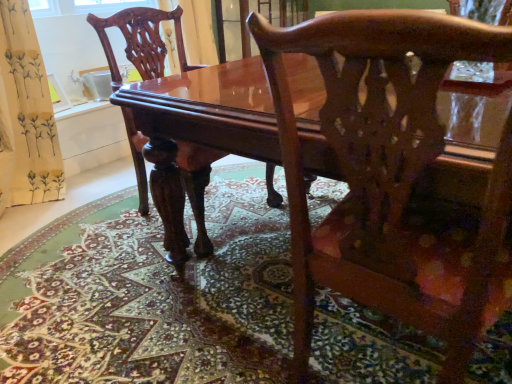
Question: Could you tell me if carpeted floor at center is facing glossy wood chair at center, placed as the 2th chair when sorted from front to back?

Choices:
 (A) no
 (B) yes

Answer: (A)

Question: Is carpeted floor at center to the right of glossy wood chair at center, which is the first chair in left-to-right order, from the viewer's perspective?

Choices:
 (A) yes
 (B) no

Answer: (B)

Question: Does carpeted floor at center have a greater width compared to glossy wood chair at center, the second chair viewed from the right?

Choices:
 (A) no
 (B) yes

Answer: (B)

Question: Does carpeted floor at center have a lesser height compared to glossy wood chair at center, the second chair viewed from the right?

Choices:
 (A) yes
 (B) no

Answer: (A)

Question: Is carpeted floor at center further to the viewer compared to glossy wood chair at center, placed as the first chair when sorted from back to front?

Choices:
 (A) yes
 (B) no

Answer: (B)

Question: Is carpeted floor at center not close to glossy wood chair at center, which is the first chair in left-to-right order?

Choices:
 (A) no
 (B) yes

Answer: (A)

Question: Is the position of glossy wood table at center more distant than that of glossy wood chair at center, arranged as the 2th chair when viewed from the left?

Choices:
 (A) yes
 (B) no

Answer: (A)

Question: Is there a large distance between glossy wood table at center and glossy wood chair at center, arranged as the 2th chair when viewed from the left?

Choices:
 (A) yes
 (B) no

Answer: (B)

Question: From a real-world perspective, is glossy wood table at center on glossy wood chair at center, which is the second chair in back-to-front order?

Choices:
 (A) yes
 (B) no

Answer: (B)

Question: Is glossy wood table at center positioned with its back to glossy wood chair at center, acting as the first chair starting from the front?

Choices:
 (A) yes
 (B) no

Answer: (B)

Question: Could you tell me if glossy wood table at center is turned towards glossy wood chair at center, which is the second chair in back-to-front order?

Choices:
 (A) no
 (B) yes

Answer: (B)

Question: Can you confirm if glossy wood table at center is thinner than glossy wood chair at center, acting as the first chair starting from the front?

Choices:
 (A) yes
 (B) no

Answer: (B)

Question: Can you confirm if glossy wood chair at center, acting as the first chair starting from the front, is thinner than glossy wood chair at center, placed as the first chair when sorted from back to front?

Choices:
 (A) no
 (B) yes

Answer: (B)